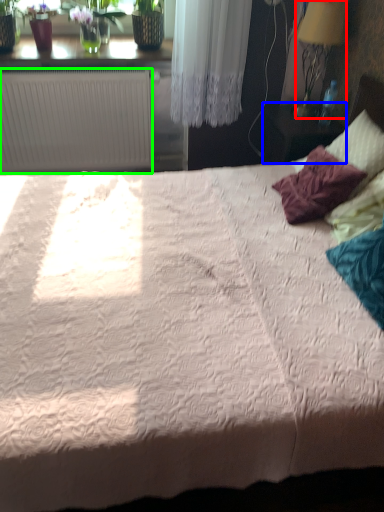
Question: Based on their relative distances, which object is farther from lamp (highlighted by a red box)? Choose from table (highlighted by a blue box) and radiator (highlighted by a green box).

Choices:
 (A) table
 (B) radiator

Answer: (B)